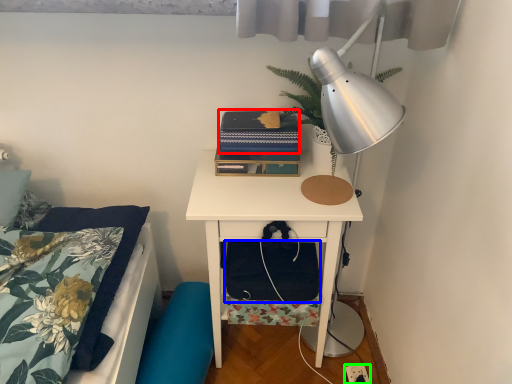
Question: Which is nearer to the paperback book (highlighted by a red box)? footrest (highlighted by a blue box) or electric outlet (highlighted by a green box).

Choices:
 (A) footrest
 (B) electric outlet

Answer: (A)